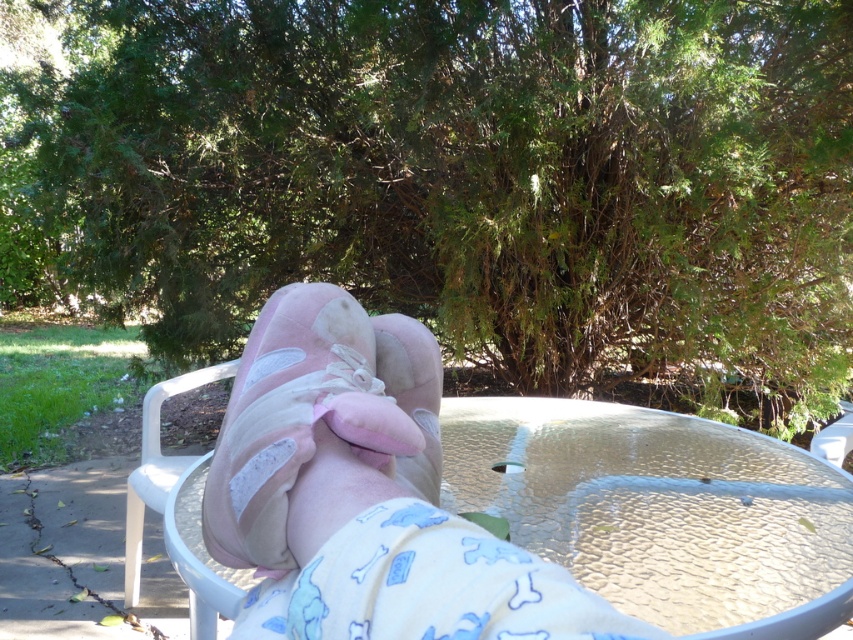
Between clear glass table at center and pink suede slippers at center, which one appears on the right side from the viewer's perspective?

clear glass table at center

Between point (778, 570) and point (252, 518), which one is positioned in front?

Point (252, 518) is more forward.

Is point (570, 560) behind point (294, 317)?

Yes.

This screenshot has width=853, height=640. What are the coordinates of `clear glass table at center` in the screenshot? It's located at (664, 509).